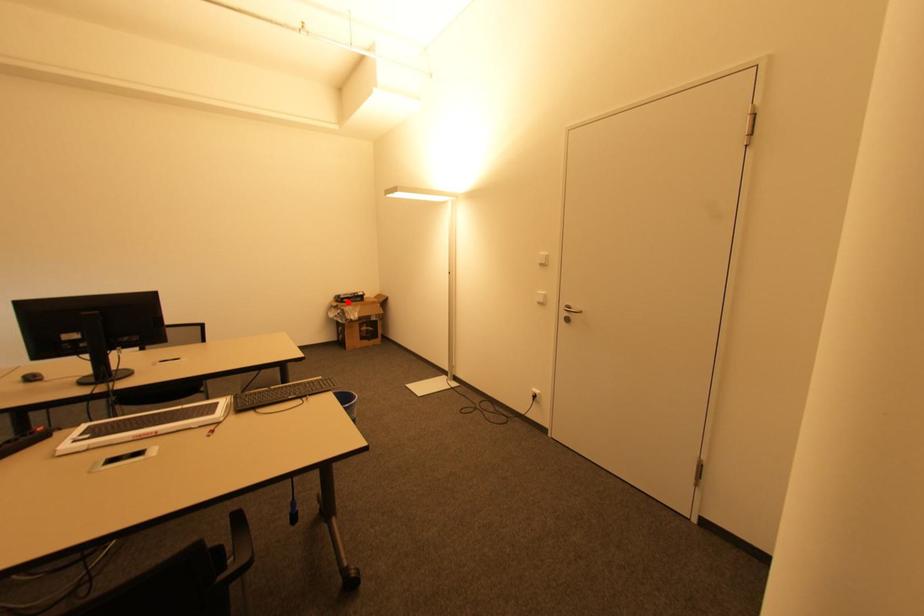
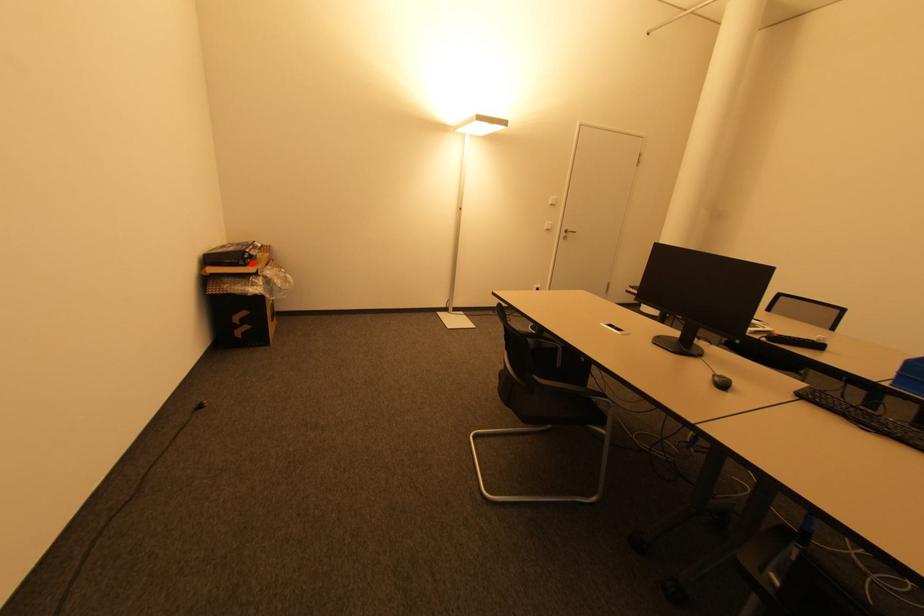
I am providing you with two images of the same scene from different viewpoints. A red point is marked on the first image and another point is marked on the second image. Does the point marked in image1 correspond to the same location as the one in image2?

Yes